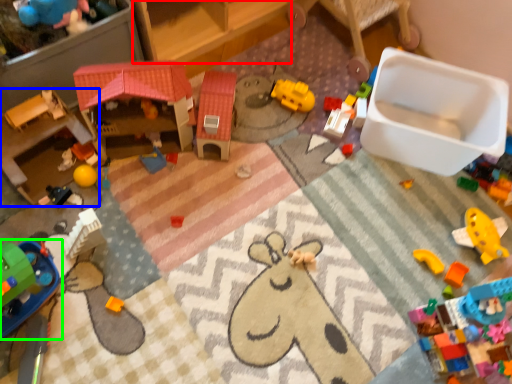
Question: Considering the real-world distances, which object is closest to furniture (highlighted by a red box)? toy (highlighted by a blue box) or toy (highlighted by a green box).

Choices:
 (A) toy
 (B) toy

Answer: (A)